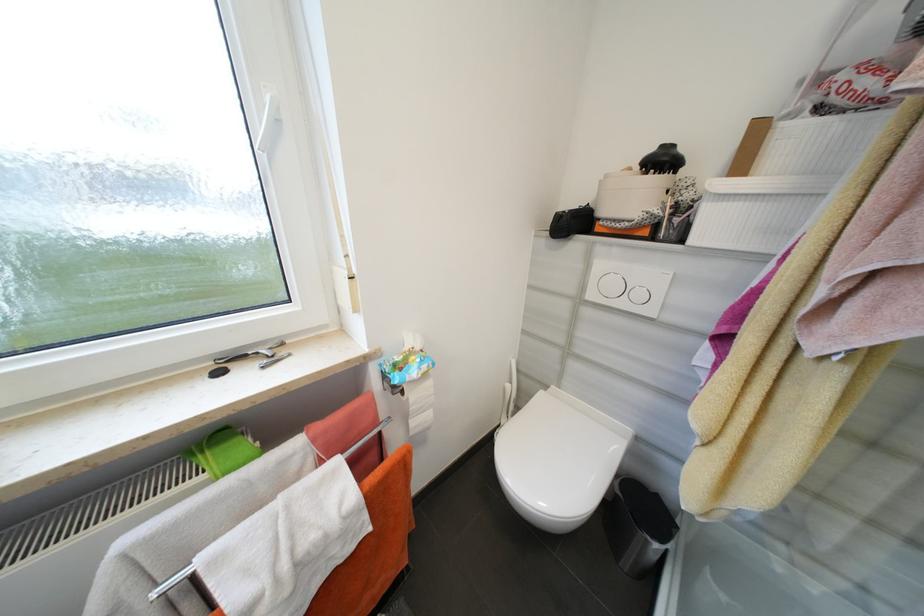
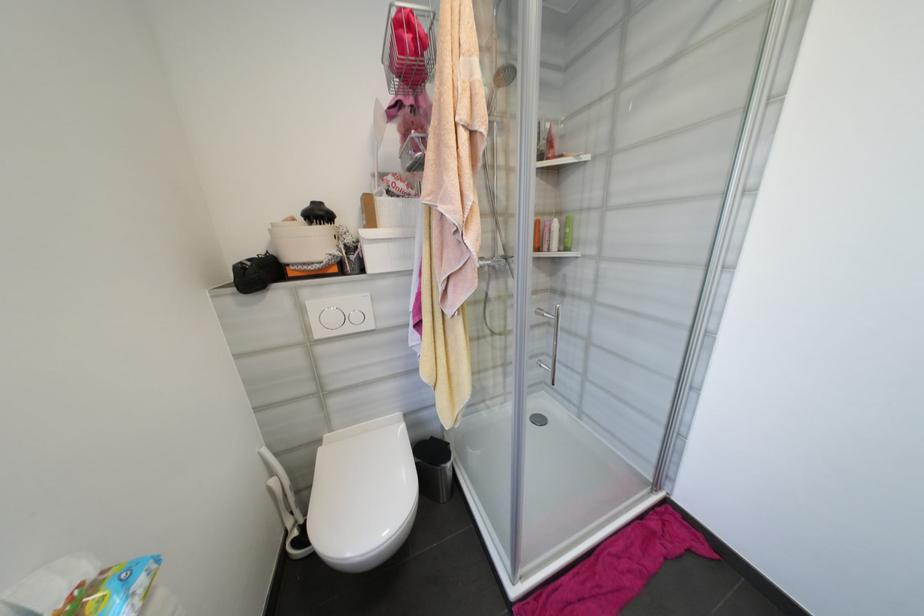
In the second image, find the point that corresponds to point 612,177 in the first image.

(280, 225)